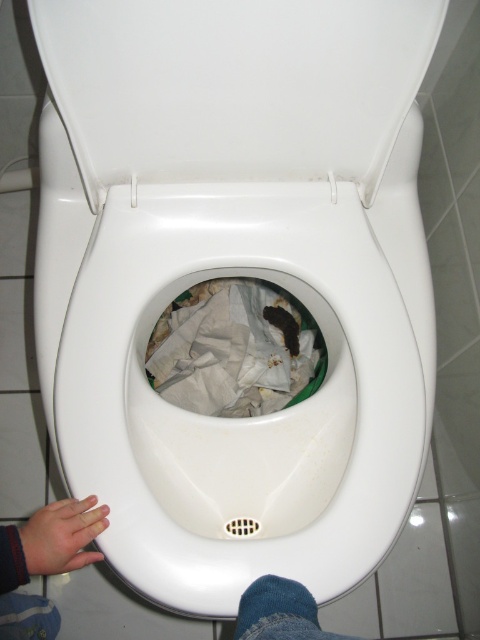
You are a cleaning robot with a height of 36 inches. You are positioned at point (206, 312) in the scene. Can you safely stand up without hitting your head on any objects in the scene?

The distance between point (206, 312) and the camera is 38.40 inches. Since the robot is 36 inches tall, there is enough clearance for it to stand up safely.

You are a cleaning robot with a 12 inch wide cleaning arm. You need to clean the area between the white glossy toilet lid at upper center and the white crumpled paper at center. Can your arm fit in that space?

The distance between the white glossy toilet lid at upper center and the white crumpled paper at center is 14.60 inches. Since your cleaning arm is 12 inches wide, it can fit in the space between them.